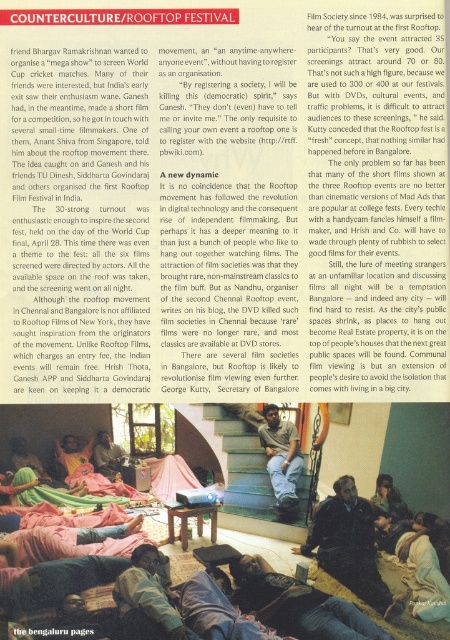
Question: Can you confirm if dark blue jeans at lower center is positioned above matte black laptop at center?

Choices:
 (A) no
 (B) yes

Answer: (B)

Question: Which point appears closest to the camera in this image?

Choices:
 (A) (67, 445)
 (B) (352, 493)
 (C) (112, 454)

Answer: (B)

Question: Is dark brown leather jacket at center closer to camera compared to dark blue jeans at center?

Choices:
 (A) yes
 (B) no

Answer: (B)

Question: Which object appears farthest from the camera in this image?

Choices:
 (A) dark brown leather jacket at center
 (B) light blue jeans at center

Answer: (B)

Question: Can you confirm if dark brown leather jacket at center is positioned to the right of dark blue jeans at center?

Choices:
 (A) no
 (B) yes

Answer: (B)

Question: Which object is positioned farthest from the smooth wooden chair at center?

Choices:
 (A) light blue jeans at center
 (B) matte black laptop at center

Answer: (A)